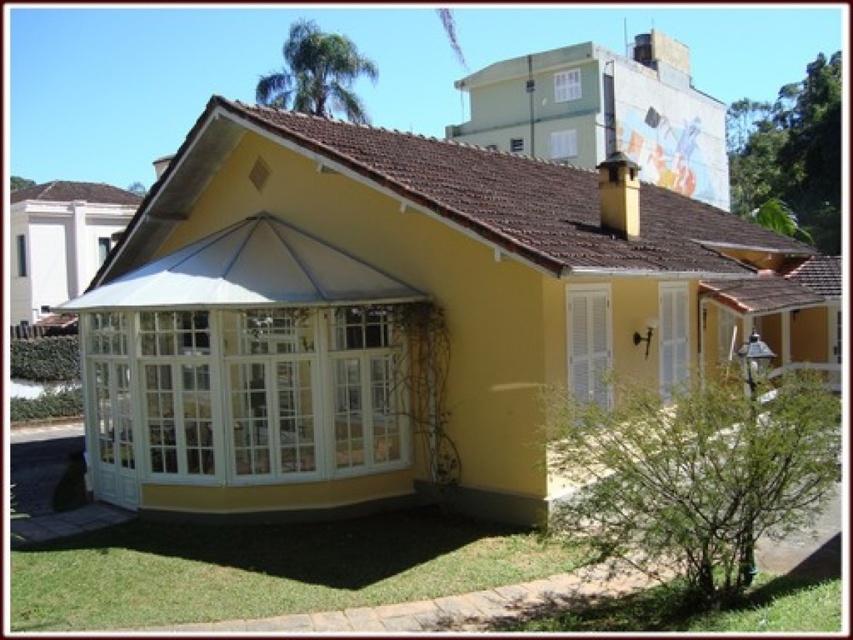
Question: Can you confirm if white glass gazebo at center is wider than white fabric canopy at center?

Choices:
 (A) yes
 (B) no

Answer: (A)

Question: Which object is positioned closest to the white glass gazebo at center?

Choices:
 (A) white fabric canopy at center
 (B) white glass conservatory at center

Answer: (A)

Question: Is white glass conservatory at center above white glass gazebo at center?

Choices:
 (A) yes
 (B) no

Answer: (A)

Question: Is white glass conservatory at center further to camera compared to white fabric canopy at center?

Choices:
 (A) no
 (B) yes

Answer: (A)

Question: Which point appears farthest from the camera in this image?

Choices:
 (A) (90, 419)
 (B) (216, 285)

Answer: (A)

Question: Estimate the real-world distances between objects in this image. Which object is closer to the white fabric canopy at center?

Choices:
 (A) white glass conservatory at center
 (B) white glass gazebo at center

Answer: (B)